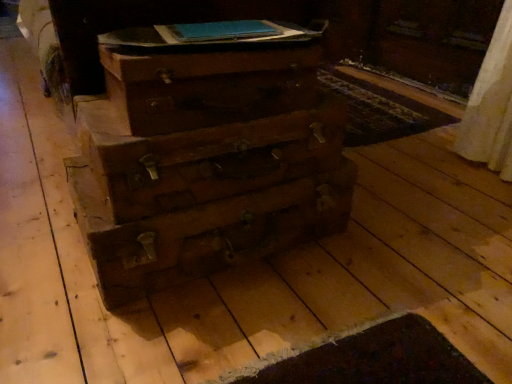
Question: Is the position of wooden chest of drawers at center more distant than that of wooden drawer at center, which appears as the second drawer when viewed from the top?

Choices:
 (A) no
 (B) yes

Answer: (B)

Question: From the image's perspective, is wooden chest of drawers at center on top of wooden drawer at center, which appears as the second drawer when viewed from the top?

Choices:
 (A) no
 (B) yes

Answer: (A)

Question: Could you tell me if wooden chest of drawers at center is facing wooden drawer at center, the first drawer from the bottom?

Choices:
 (A) yes
 (B) no

Answer: (B)

Question: Would you say wooden drawer at center, the first drawer from the bottom, is part of wooden chest of drawers at center's contents?

Choices:
 (A) no
 (B) yes

Answer: (A)

Question: From a real-world perspective, is wooden chest of drawers at center physically below wooden drawer at center, which appears as the second drawer when viewed from the top?

Choices:
 (A) no
 (B) yes

Answer: (B)

Question: Does wooden chest of drawers at center have a greater height compared to wooden drawer at center, which appears as the second drawer when viewed from the top?

Choices:
 (A) yes
 (B) no

Answer: (B)

Question: Is blue paper book at upper center located outside wooden chest of drawers at center?

Choices:
 (A) no
 (B) yes

Answer: (B)

Question: Does blue paper book at upper center have a greater height compared to wooden chest of drawers at center?

Choices:
 (A) yes
 (B) no

Answer: (B)

Question: Is blue paper book at upper center positioned in front of wooden chest of drawers at center?

Choices:
 (A) no
 (B) yes

Answer: (A)

Question: Is blue paper book at upper center looking in the opposite direction of wooden chest of drawers at center?

Choices:
 (A) yes
 (B) no

Answer: (B)

Question: Is blue paper book at upper center bigger than wooden chest of drawers at center?

Choices:
 (A) no
 (B) yes

Answer: (A)

Question: Can wooden chest of drawers at center be found inside blue paper book at upper center?

Choices:
 (A) yes
 (B) no

Answer: (B)

Question: Considering the relative sizes of wooden drawer at center, the 1th drawer viewed from the top, and blue paper book at upper center in the image provided, is wooden drawer at center, the 1th drawer viewed from the top, wider than blue paper book at upper center?

Choices:
 (A) no
 (B) yes

Answer: (B)